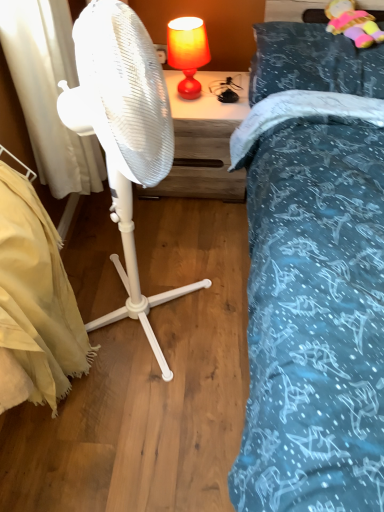
Find the location of `free spot to the right of matte orange lampshade at upper center`. free spot to the right of matte orange lampshade at upper center is located at coordinates pos(226,104).